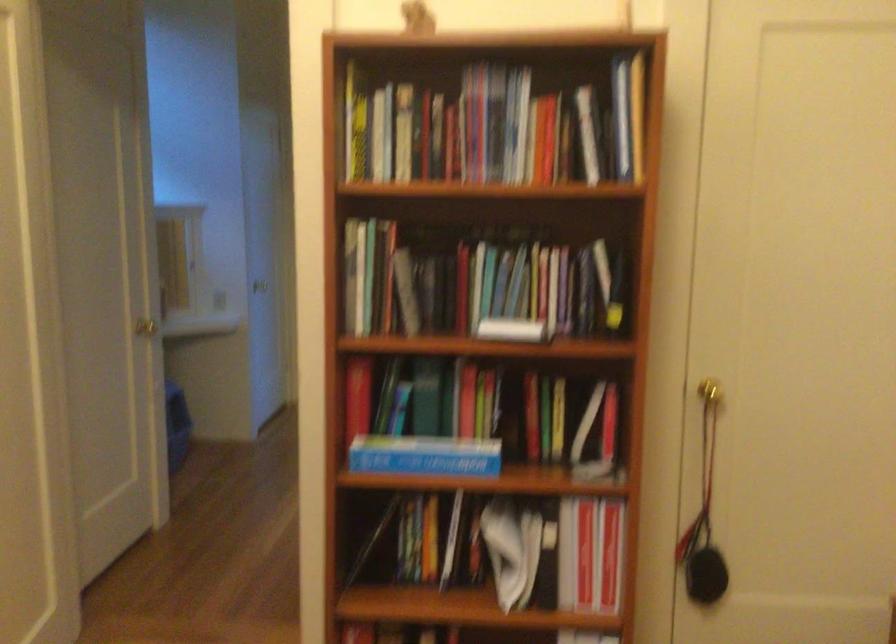
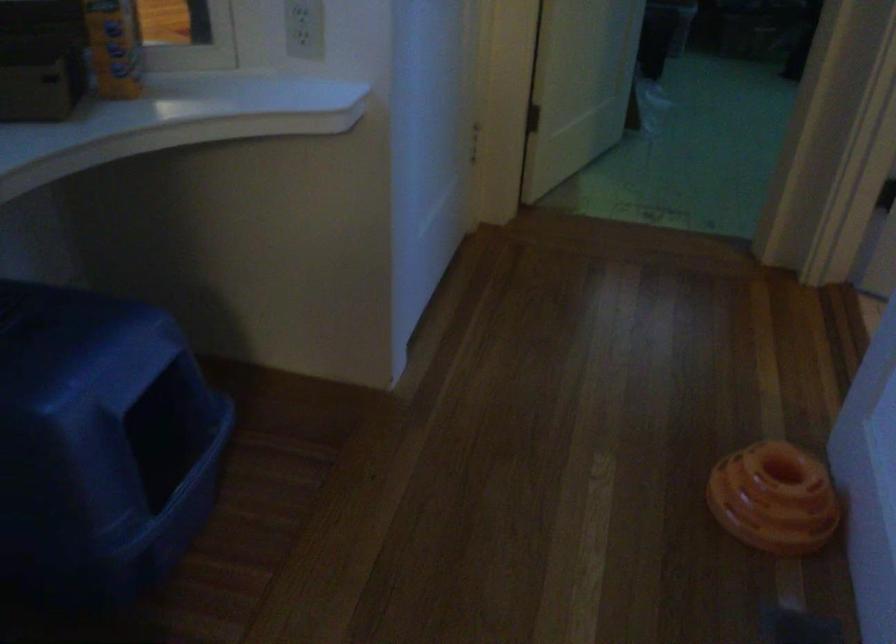
In the second image, find the point that corresponds to (x=167, y=301) in the first image.

(114, 46)